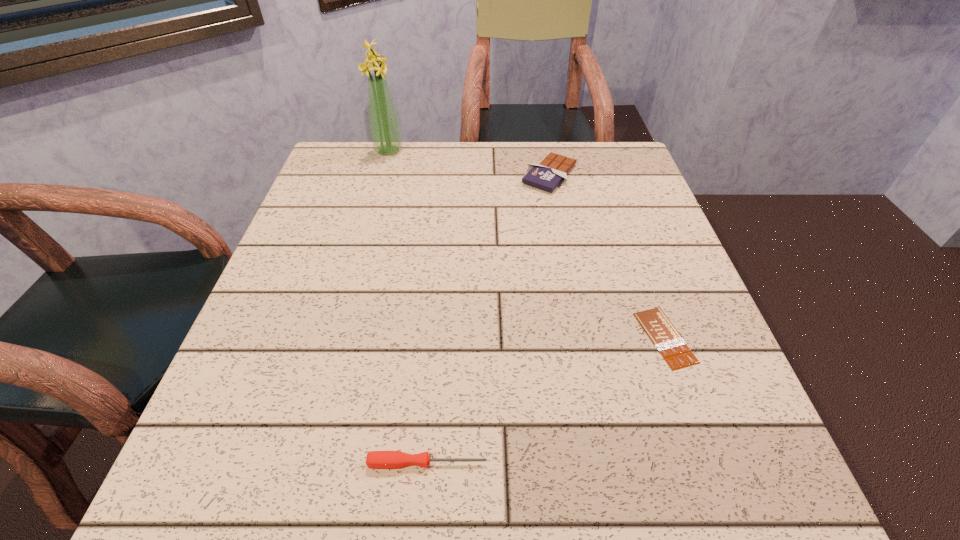
You are a GUI agent. You are given a task and a screenshot of the screen. Output one action in this format:
    pyautogui.click(x=<x>, y=<y>)
    Task: Click on the vacant region between the left chocolate bar and the third object from right to left
    
    Given the screenshot: What is the action you would take?
    pyautogui.click(x=489, y=319)

What are the coordinates of `free space between the bouquet and the taller chocolate bar` in the screenshot? It's located at (469, 163).

You are a GUI agent. You are given a task and a screenshot of the screen. Output one action in this format:
    pyautogui.click(x=<x>, y=<y>)
    Task: Click on the free point between the tallest object and the left chocolate bar
    Image resolution: width=960 pixels, height=540 pixels.
    Given the screenshot: What is the action you would take?
    pyautogui.click(x=469, y=163)

Locate an element on the screen. This screenshot has width=960, height=540. vacant point located between the rightmost object and the taller chocolate bar is located at coordinates (608, 256).

In order to click on vacant space that's between the third tallest object and the right chocolate bar in this screenshot , I will do `click(546, 400)`.

Identify which object is located as the second nearest to the right chocolate bar. Please provide its 2D coordinates. Your answer should be formatted as a tuple, i.e. [(x, y)], where the tuple contains the x and y coordinates of a point satisfying the conditions above.

[(552, 170)]

Locate an element on the screen. The width and height of the screenshot is (960, 540). object that is the second closest to the taller chocolate bar is located at coordinates (673, 348).

Locate an element on the screen. Image resolution: width=960 pixels, height=540 pixels. vacant area in the image that satisfies the following two spatial constraints: 1. on the front-facing side of the rightmost object; 2. on the left side of the leftmost object is located at coordinates (337, 338).

You are a GUI agent. You are given a task and a screenshot of the screen. Output one action in this format:
    pyautogui.click(x=<x>, y=<y>)
    Task: Click on the free space that satisfies the following two spatial constraints: 1. on the front-facing side of the leftmost object; 2. on the right side of the shorter chocolate bar
    
    Given the screenshot: What is the action you would take?
    pyautogui.click(x=337, y=338)

The height and width of the screenshot is (540, 960). Identify the location of vacant space that satisfies the following two spatial constraints: 1. on the front side of the left chocolate bar; 2. at the tip of the nearest object. (606, 463).